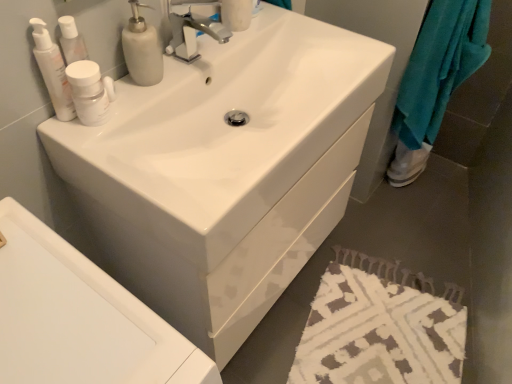
Locate an element on the screen. free space above white glossy sink at center (from a real-world perspective) is located at coordinates (75, 314).